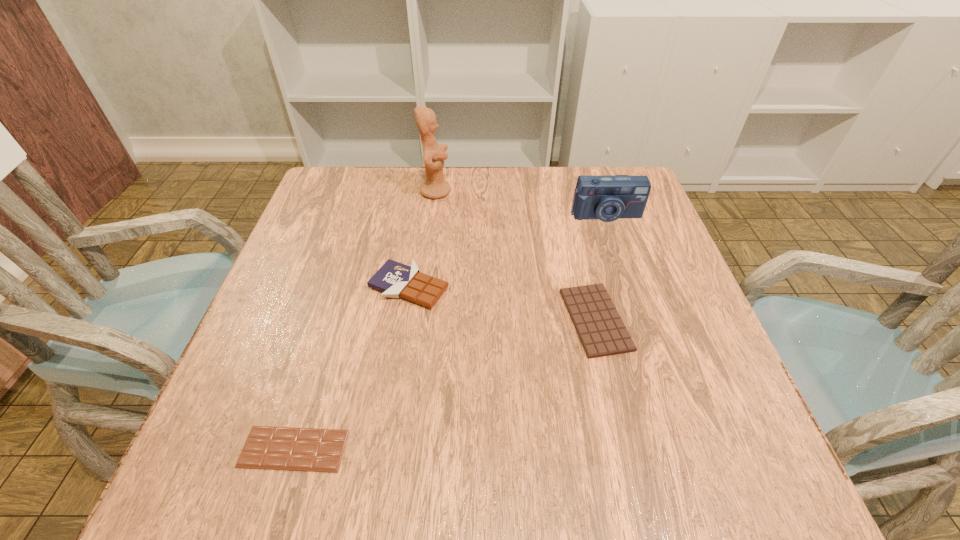
Find the location of a particular element. The height and width of the screenshot is (540, 960). the tallest object is located at coordinates (434, 187).

Identify the location of the farthest object. (434, 187).

Where is `the fourth shortest object`? This screenshot has width=960, height=540. the fourth shortest object is located at coordinates (609, 197).

Locate an element on the screen. This screenshot has height=540, width=960. the fourth nearest object is located at coordinates (609, 197).

Where is `the tallest chocolate bar`? the tallest chocolate bar is located at coordinates [x=394, y=279].

This screenshot has width=960, height=540. What are the coordinates of `the second shortest object` in the screenshot? It's located at (597, 322).

Find the location of `the rightmost chocolate bar`. the rightmost chocolate bar is located at coordinates [x=597, y=322].

Locate an element on the screen. The image size is (960, 540). the nearest object is located at coordinates (275, 448).

At what (x,y) coordinates should I click in order to perform the action: click on the nearest chocolate bar. Please return your answer as a coordinate pair (x, y). This screenshot has height=540, width=960. Looking at the image, I should click on (275, 448).

Where is `free space located 0.320m on the front-facing side of the farthest object`? The image size is (960, 540). free space located 0.320m on the front-facing side of the farthest object is located at coordinates (568, 191).